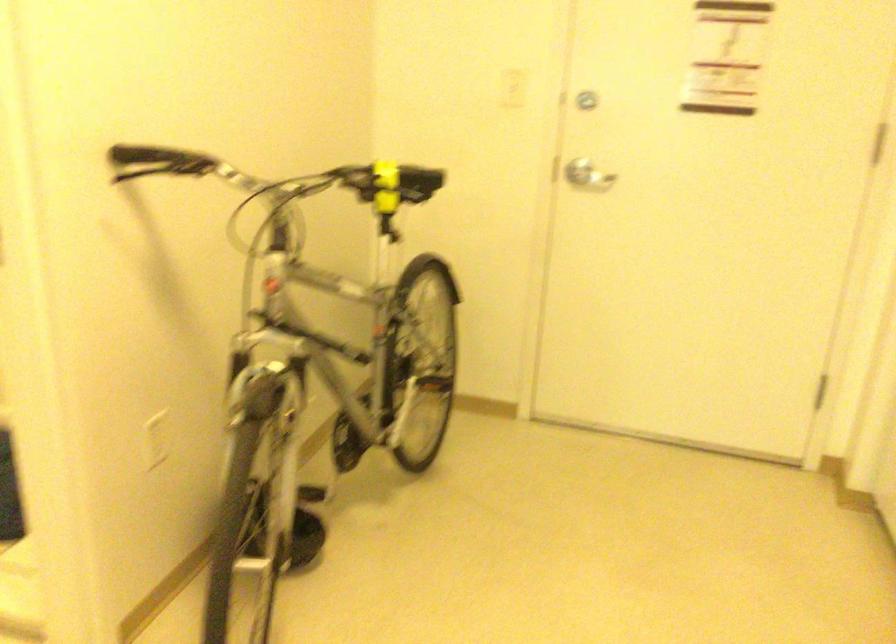
Image resolution: width=896 pixels, height=644 pixels. What do you see at coordinates (420, 178) in the screenshot? I see `a bicycle seat` at bounding box center [420, 178].